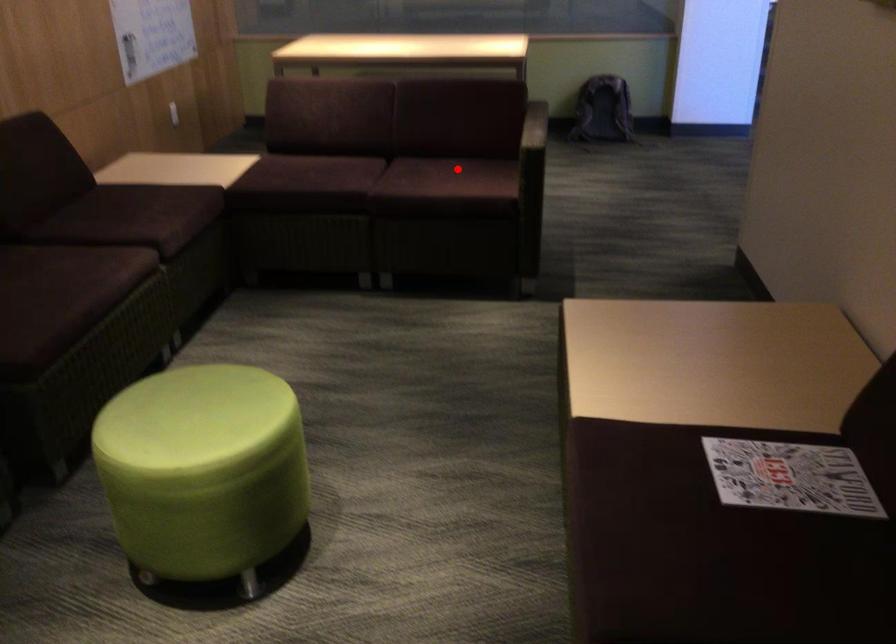
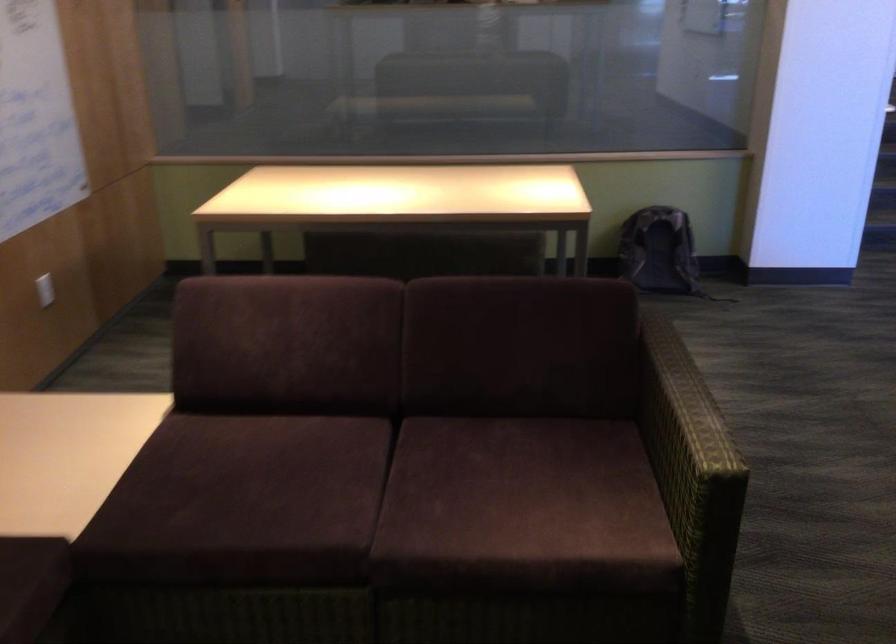
In the second image, find the point that corresponds to the highlighted location in the first image.

(526, 474)